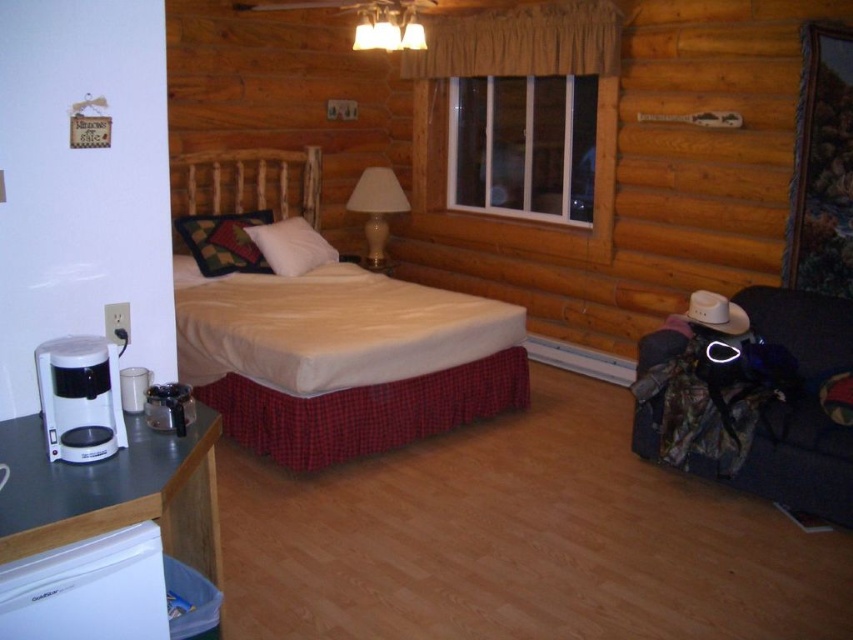
Which of these two, camouflage fabric bag at lower right or matte glass lamp at upper center, stands taller?

camouflage fabric bag at lower right

At what (x,y) coordinates should I click in order to perform the action: click on camouflage fabric bag at lower right. Please return your answer as a coordinate pair (x, y). This screenshot has height=640, width=853. Looking at the image, I should click on (753, 404).

Is multicolored woven pillow at center behind matte glass lamp at upper center?

Yes, multicolored woven pillow at center is further from the viewer.

Describe the element at coordinates (223, 241) in the screenshot. I see `multicolored woven pillow at center` at that location.

Identify the location of multicolored woven pillow at center. (223, 241).

Which of these two, camouflage fabric bag at lower right or white ceramic lamp at upper center, stands shorter?

Standing shorter between the two is white ceramic lamp at upper center.

Does camouflage fabric bag at lower right lie in front of white ceramic lamp at upper center?

Yes, camouflage fabric bag at lower right is closer to the viewer.

I want to click on camouflage fabric bag at lower right, so click(x=753, y=404).